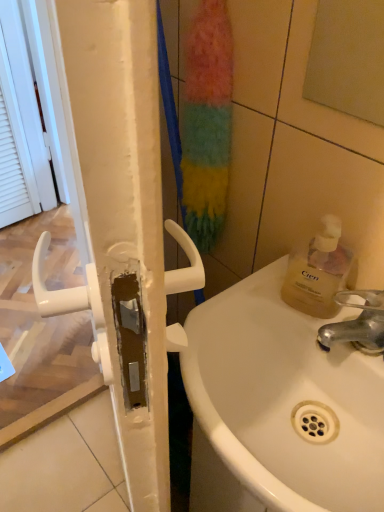
Question: Does white plastic screen door at left touch silver metallic faucet at sink right?

Choices:
 (A) no
 (B) yes

Answer: (A)

Question: From the image's perspective, is white plastic screen door at left located above silver metallic faucet at sink right?

Choices:
 (A) yes
 (B) no

Answer: (A)

Question: Is white plastic screen door at left outside of silver metallic faucet at sink right?

Choices:
 (A) no
 (B) yes

Answer: (B)

Question: Can you confirm if white plastic screen door at left is taller than silver metallic faucet at sink right?

Choices:
 (A) no
 (B) yes

Answer: (B)

Question: Does white plastic screen door at left come in front of silver metallic faucet at sink right?

Choices:
 (A) no
 (B) yes

Answer: (A)

Question: Is white plastic screen door at left behind silver metallic faucet at sink right?

Choices:
 (A) no
 (B) yes

Answer: (B)

Question: Considering the relative sizes of white plastic screen door at left and translucent yellow liquid at sink right in the image provided, is white plastic screen door at left shorter than translucent yellow liquid at sink right?

Choices:
 (A) no
 (B) yes

Answer: (A)

Question: Is white plastic screen door at left at the right side of translucent yellow liquid at sink right?

Choices:
 (A) no
 (B) yes

Answer: (A)

Question: Would you say translucent yellow liquid at sink right is part of white plastic screen door at left's contents?

Choices:
 (A) yes
 (B) no

Answer: (B)

Question: Are white plastic screen door at left and translucent yellow liquid at sink right far apart?

Choices:
 (A) yes
 (B) no

Answer: (A)

Question: From a real-world perspective, is white plastic screen door at left beneath translucent yellow liquid at sink right?

Choices:
 (A) yes
 (B) no

Answer: (A)

Question: Is white plastic screen door at left positioned in front of translucent yellow liquid at sink right?

Choices:
 (A) no
 (B) yes

Answer: (A)

Question: Is translucent yellow liquid at sink right positioned before matte glass mirror at upper right?

Choices:
 (A) no
 (B) yes

Answer: (A)